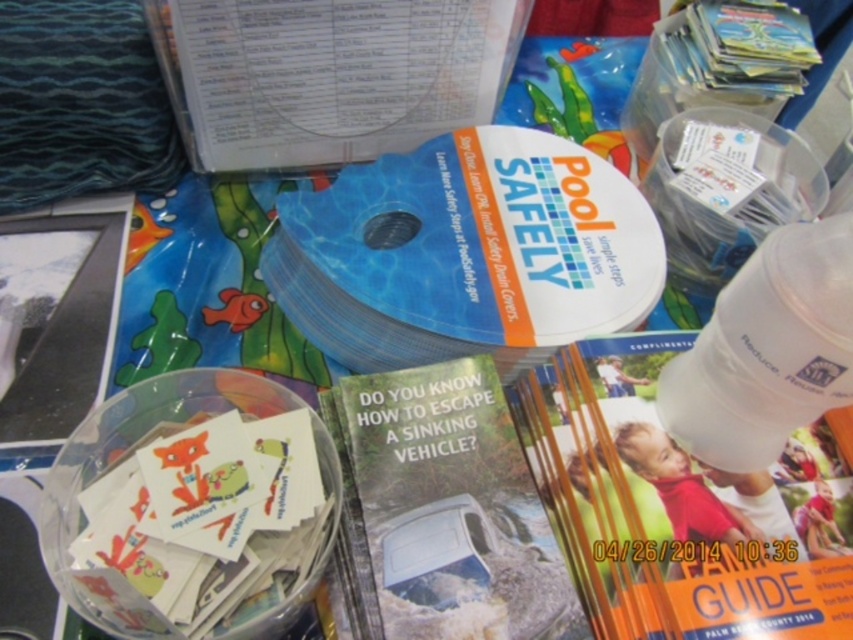
From the picture: You are organizing a safety fair and need to display two items on a table. You have a matte paper guide at center and a green glossy brochure at center. Which item is taller?

The matte paper guide at center is taller than the green glossy brochure at center.

You are organizing a safety booth and need to place a 12 inch wide decorative item between the matte paper guide at center and the white glossy magazine at upper center. Can you fit it there?

The distance between the matte paper guide at center and the white glossy magazine at upper center is 13.49 inches, so yes, the 12 inch wide decorative item can fit between them.